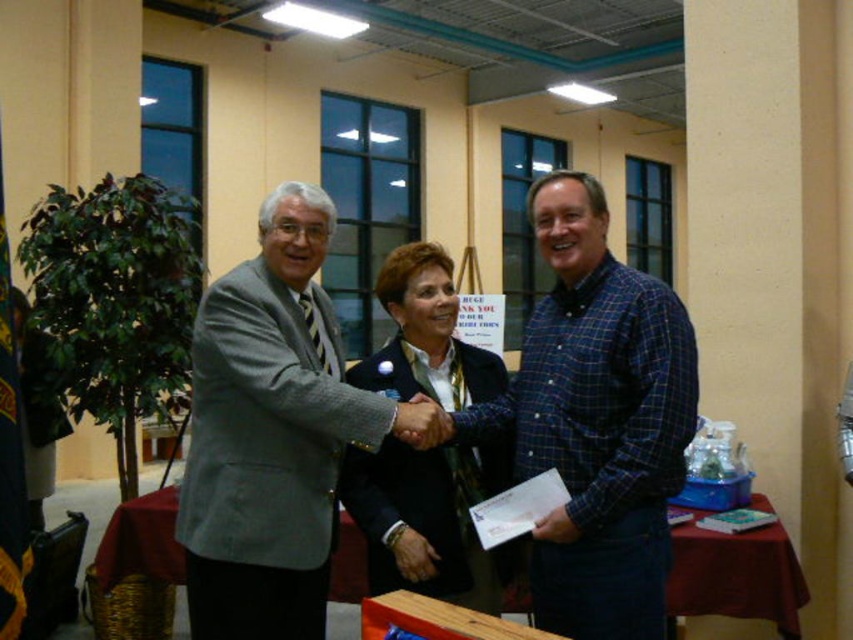
Which is below, gray wool suit at center or dark blue jacket at center?

dark blue jacket at center is below.

Is gray wool suit at center to the left of dark blue jacket at center from the viewer's perspective?

Yes, gray wool suit at center is to the left of dark blue jacket at center.

Which is behind, point (257, 592) or point (403, 276)?

Point (403, 276)

This screenshot has width=853, height=640. In order to click on gray wool suit at center in this screenshot , I will do `click(271, 433)`.

From the picture: Can you confirm if wooden table at center is positioned to the right of maroon fabric table at lower right?

Correct, you'll find wooden table at center to the right of maroon fabric table at lower right.

Between wooden table at center and maroon fabric table at lower right, which one has less height?

wooden table at center

The height and width of the screenshot is (640, 853). Describe the element at coordinates (735, 577) in the screenshot. I see `wooden table at center` at that location.

Find the location of a particular element. Image resolution: width=853 pixels, height=640 pixels. wooden table at center is located at coordinates (735, 577).

Does point (386, 548) come closer to viewer compared to point (790, 582)?

That is True.

Can you confirm if dark blue jacket at center is smaller than wooden table at center?

No, dark blue jacket at center is not smaller than wooden table at center.

Who is more forward, (393, 353) or (115, 536)?

Point (393, 353) is in front.

The image size is (853, 640). Identify the location of dark blue jacket at center. (428, 518).